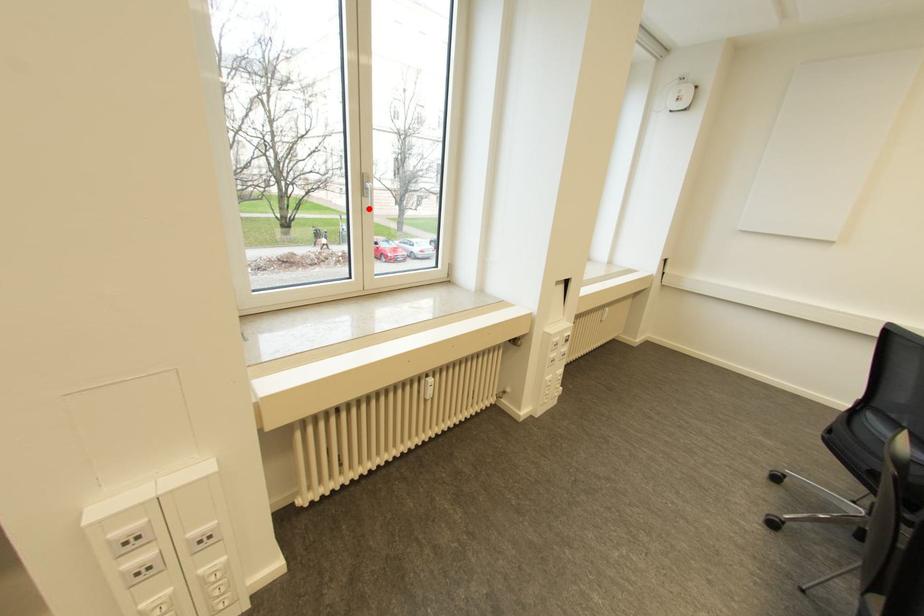
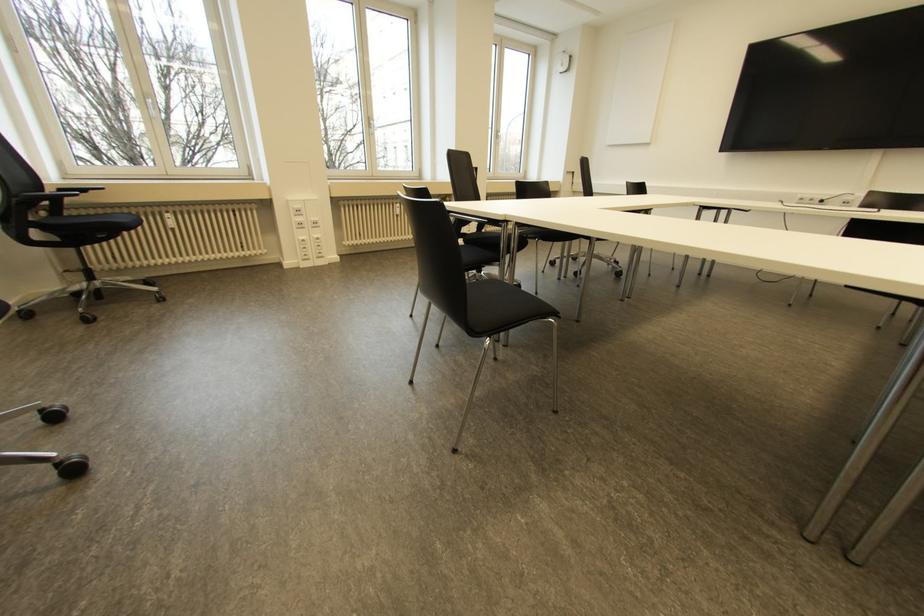
The point at the highlighted location is marked in the first image. Where is the corresponding point in the second image?

(372, 134)